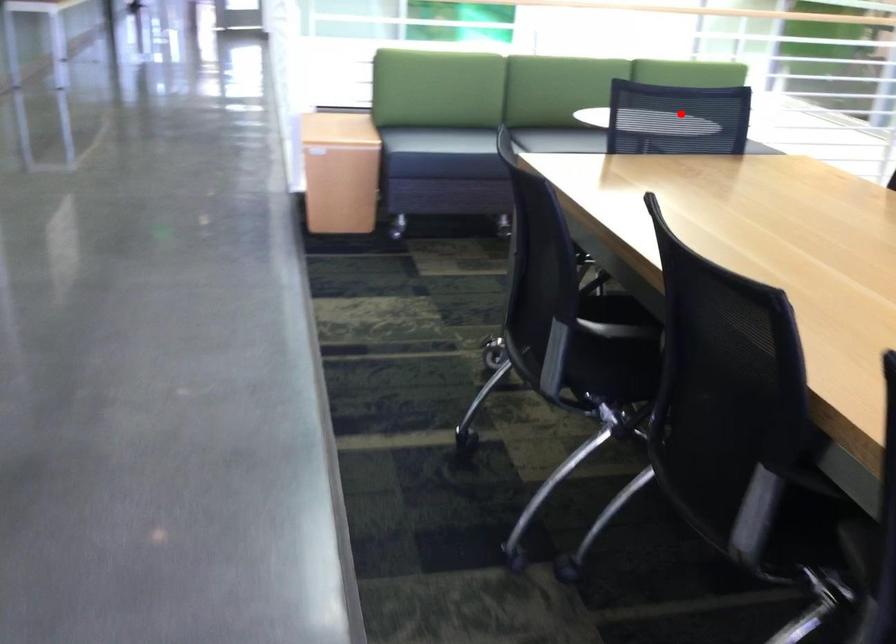
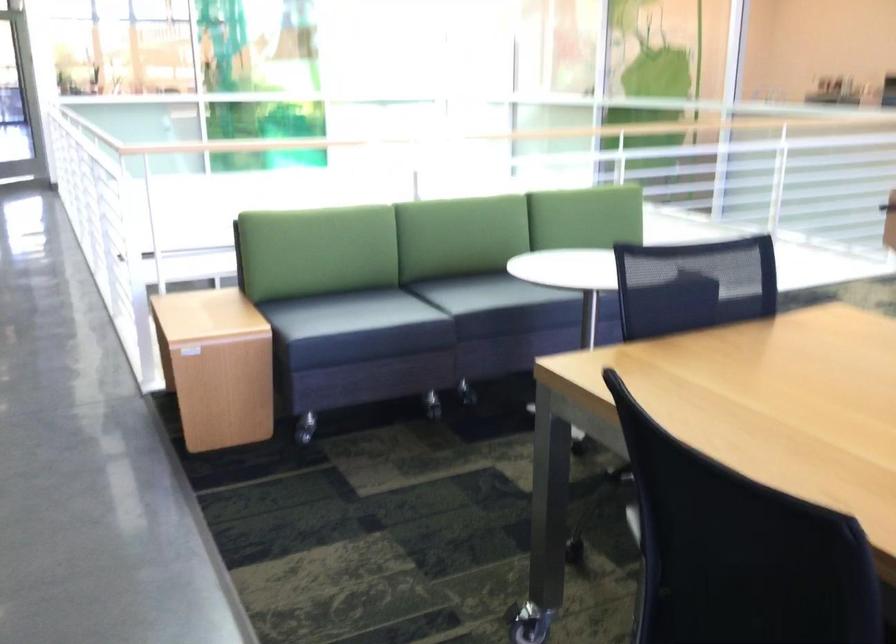
Question: I am providing you with two images of the same scene from different viewpoints. Image1 has a red point marked. In image2, the corresponding 3D location appears at what relative position? Reply with the corresponding letter.

Choices:
 (A) Closer
 (B) Farther

Answer: (A)